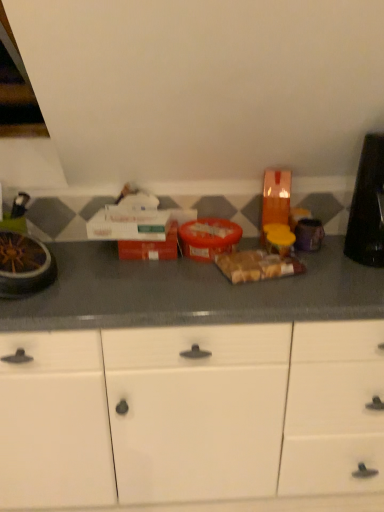
Question: Is translucent plastic bag of bread at center bigger than white matte cabinet at center?

Choices:
 (A) no
 (B) yes

Answer: (A)

Question: Is translucent plastic bag of bread at center aimed at white matte cabinet at center?

Choices:
 (A) yes
 (B) no

Answer: (B)

Question: From the image's perspective, would you say translucent plastic bag of bread at center is shown under white matte cabinet at center?

Choices:
 (A) yes
 (B) no

Answer: (B)

Question: From a real-world perspective, does translucent plastic bag of bread at center stand above white matte cabinet at center?

Choices:
 (A) no
 (B) yes

Answer: (B)

Question: Is translucent plastic bag of bread at center next to white matte cabinet at center and touching it?

Choices:
 (A) no
 (B) yes

Answer: (A)

Question: Can you confirm if translucent plastic bag of bread at center is smaller than white matte cabinet at center?

Choices:
 (A) no
 (B) yes

Answer: (B)

Question: Considering the relative sizes of black plastic toaster at right, the first appliance viewed from the right, and white matte cabinet at center in the image provided, is black plastic toaster at right, the first appliance viewed from the right, bigger than white matte cabinet at center?

Choices:
 (A) no
 (B) yes

Answer: (A)

Question: Is the position of black plastic toaster at right, the first appliance viewed from the right, less distant than that of white matte cabinet at center?

Choices:
 (A) no
 (B) yes

Answer: (A)

Question: From a real-world perspective, does black plastic toaster at right, the first appliance viewed from the right, stand above white matte cabinet at center?

Choices:
 (A) no
 (B) yes

Answer: (B)

Question: Is black plastic toaster at right, which ranks as the 2th appliance in left-to-right order, not near white matte cabinet at center?

Choices:
 (A) no
 (B) yes

Answer: (A)

Question: From a real-world perspective, is black plastic toaster at right, the first appliance viewed from the right, below white matte cabinet at center?

Choices:
 (A) no
 (B) yes

Answer: (A)

Question: Is black plastic toaster at right, the first appliance viewed from the right, further to camera compared to white matte cabinet at center?

Choices:
 (A) no
 (B) yes

Answer: (B)

Question: Is metallic silver bowl at left, positioned as the first appliance in left-to-right order, turned away from black plastic toaster at right, which ranks as the 2th appliance in left-to-right order?

Choices:
 (A) yes
 (B) no

Answer: (B)